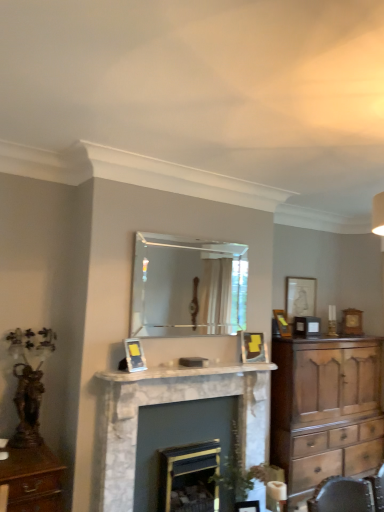
Question: Is clear glass mirror at center wider or thinner than marble fireplace at center, the second fireplace in the right-to-left sequence?

Choices:
 (A) wide
 (B) thin

Answer: (B)

Question: In the image, is clear glass mirror at center on the left side or the right side of marble fireplace at center, the second fireplace in the right-to-left sequence?

Choices:
 (A) left
 (B) right

Answer: (B)

Question: Considering the real-world distances, which object is closest to the dark gray marble fireplace at center, which appears as the first fireplace when viewed from the right?

Choices:
 (A) white marble fireplace mantel at center
 (B) matte gold picture frame at center, the fourth picture frame in the right-to-left sequence
 (C) matte gold picture frame at upper right, the second picture frame viewed from the right
 (D) clear glass mirror at center
 (E) wooden chest of drawers at right

Answer: (A)

Question: Estimate the real-world distances between objects in this image. Which object is farther from the dark gray marble fireplace at center, arranged as the 2th fireplace when viewed from the left?

Choices:
 (A) clear glass mirror at center
 (B) marble fireplace at center, acting as the 1th fireplace starting from the left
 (C) matte gold picture frame at center, the fourth picture frame in the right-to-left sequence
 (D) wooden chest of drawers at right
 (E) matte silver picture frame at upper right, the 1th picture frame viewed from the back

Answer: (A)